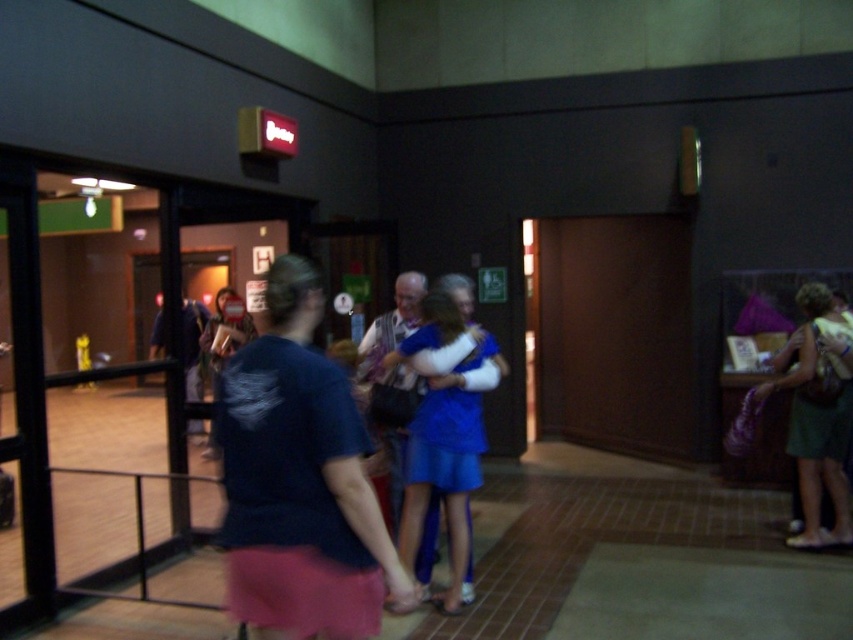
Question: Which is nearer to the blue satin dress at center?

Choices:
 (A) dark blue shirt at left
 (B) dark blue shirt at center
 (C) green fabric dress at right
 (D) matte blue dress at center

Answer: (B)

Question: Is matte blue dress at center below dark blue shirt at left?

Choices:
 (A) no
 (B) yes

Answer: (B)

Question: Estimate the real-world distances between objects in this image. Which object is closer to the green fabric dress at right?

Choices:
 (A) dark blue shirt at center
 (B) dark blue shirt at left
 (C) matte blue dress at center

Answer: (A)

Question: Is dark blue shirt at center to the right of matte blue dress at center from the viewer's perspective?

Choices:
 (A) yes
 (B) no

Answer: (A)

Question: Which is nearer to the dark blue shirt at center?

Choices:
 (A) blue satin dress at center
 (B) green fabric dress at right
 (C) dark blue shirt at left

Answer: (A)

Question: Can you confirm if blue satin dress at center is positioned to the right of green fabric dress at right?

Choices:
 (A) yes
 (B) no

Answer: (B)